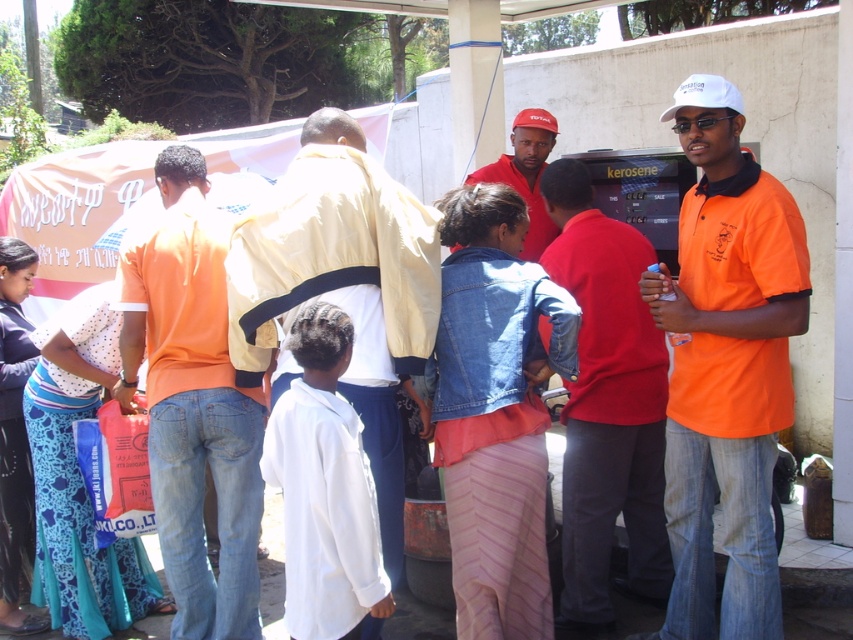
Is point (378, 221) farther from viewer compared to point (605, 506)?

No.

Who is more forward, (256, 246) or (664, 378)?

Point (256, 246) is in front.

Image resolution: width=853 pixels, height=640 pixels. Describe the element at coordinates (343, 285) in the screenshot. I see `light beige jacket at center` at that location.

You are a GUI agent. You are given a task and a screenshot of the screen. Output one action in this format:
    pyautogui.click(x=<x>, y=<y>)
    Task: Click on the light beige jacket at center
    The image size is (853, 640).
    Given the screenshot: What is the action you would take?
    pyautogui.click(x=343, y=285)

How far apart are orange cotton shirt at right and light beige jacket at center?

orange cotton shirt at right and light beige jacket at center are 3.60 feet apart from each other.

Does orange cotton shirt at right have a larger size compared to light beige jacket at center?

No.

Measure the distance between point (x=675, y=612) and camera.

11.58 feet

The height and width of the screenshot is (640, 853). I want to click on orange cotton shirt at right, so click(726, 365).

Who is taller, orange cotton shirt at center or red fabric cap at upper center?

orange cotton shirt at center

Based on the photo, does orange cotton shirt at center have a smaller size compared to red fabric cap at upper center?

No, orange cotton shirt at center is not smaller than red fabric cap at upper center.

Which is in front, point (200, 348) or point (543, 122)?

Positioned in front is point (200, 348).

Locate an element on the screen. Image resolution: width=853 pixels, height=640 pixels. orange cotton shirt at center is located at coordinates (193, 401).